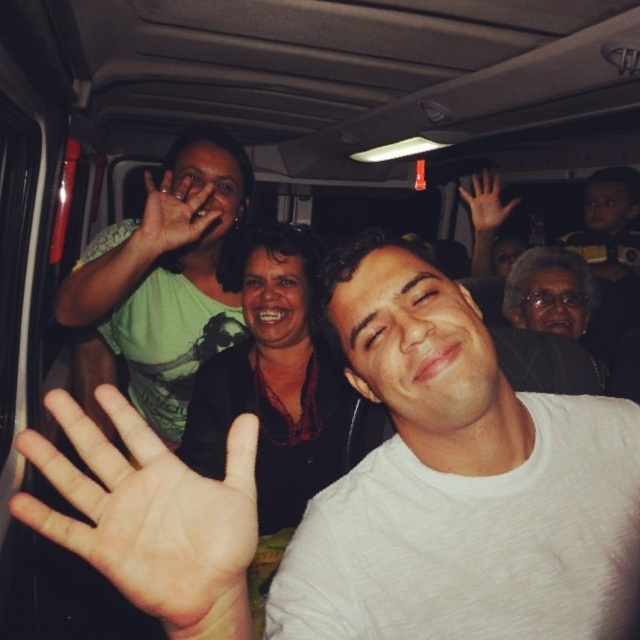
You are a photographer trying to capture a clear photo of the white cotton shirt at center and the matte green hand at upper center. Which object should you focus on first if you want to ensure both are in focus?

The white cotton shirt at center is bigger than the matte green hand at upper center, so focusing on the white cotton shirt at center first would help ensure both are in focus since it is larger and likely closer to the camera.

You are a passenger on this bus and want to wave to someone outside the window. You notice the brown skin hand at center and the matte green hand at upper center. Which hand is closer to you?

The brown skin hand at center is closer to you because it is in front of the matte green hand at upper center.

You are a passenger on the bus and want to wave back to the people. Which hand, the brown skin hand at center or the brown skin hand at upper right, is closer to your eye level if you are sitting in the middle of the bus?

The brown skin hand at upper right is closer to your eye level because it is positioned higher than the brown skin hand at center, which is located below it.